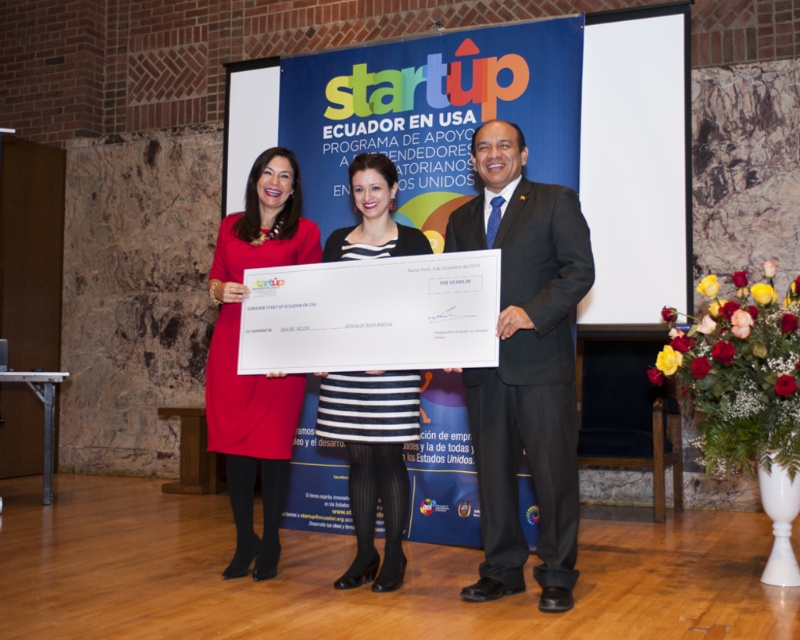
Who is shorter, matte red dress at center or striped fabric dress at center?

striped fabric dress at center is shorter.

Which is in front, point (230, 260) or point (389, 500)?

Point (389, 500)

Identify the location of matte red dress at center. (256, 374).

From the picture: Is dark gray suit at center to the left of matte red dress at center from the viewer's perspective?

In fact, dark gray suit at center is to the right of matte red dress at center.

Can you confirm if dark gray suit at center is taller than matte red dress at center?

No, dark gray suit at center is not taller than matte red dress at center.

The image size is (800, 640). Describe the element at coordinates (524, 365) in the screenshot. I see `dark gray suit at center` at that location.

You are a GUI agent. You are given a task and a screenshot of the screen. Output one action in this format:
    pyautogui.click(x=<x>, y=<y>)
    Task: Click on the dark gray suit at center
    Image resolution: width=800 pixels, height=640 pixels.
    Given the screenshot: What is the action you would take?
    pyautogui.click(x=524, y=365)

Is point (516, 442) positioned after point (418, 234)?

No, (516, 442) is closer to viewer.

Does dark gray suit at center have a lesser height compared to striped fabric dress at center?

No, dark gray suit at center is not shorter than striped fabric dress at center.

Which is in front, point (560, 285) or point (376, 189)?

Point (560, 285) is more forward.

Identify the location of dark gray suit at center. The height and width of the screenshot is (640, 800). (524, 365).